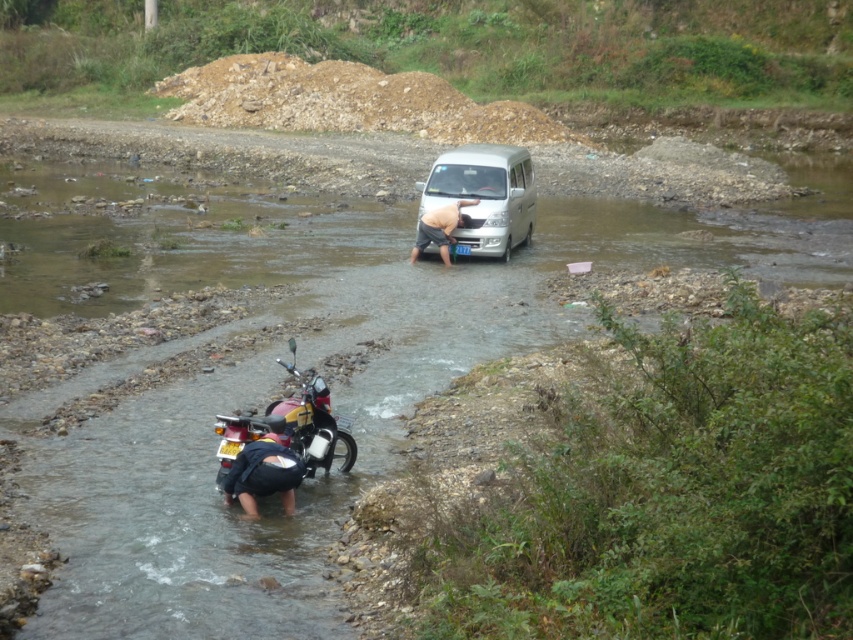
From the picture: Is white matte van at center bigger than skinny man at center?

Correct, white matte van at center is larger in size than skinny man at center.

Image resolution: width=853 pixels, height=640 pixels. Describe the element at coordinates (485, 195) in the screenshot. I see `white matte van at center` at that location.

Where is `white matte van at center`? This screenshot has width=853, height=640. white matte van at center is located at coordinates (485, 195).

Can you confirm if metallic red motorcycle at lower left is positioned below dark blue fabric pants at lower left?

Actually, metallic red motorcycle at lower left is above dark blue fabric pants at lower left.

Who is shorter, metallic red motorcycle at lower left or dark blue fabric pants at lower left?

Standing shorter between the two is dark blue fabric pants at lower left.

Which is in front, point (270, 420) or point (258, 492)?

Positioned in front is point (258, 492).

Where is `metallic red motorcycle at lower left`? metallic red motorcycle at lower left is located at coordinates (289, 428).

Can you confirm if white matte van at center is shorter than dark blue fabric pants at lower left?

No.

Between point (485, 234) and point (263, 486), which one is positioned behind?

Point (485, 234)

Is point (509, 150) farther from viewer compared to point (265, 448)?

Yes, it is.

Where is `white matte van at center`? The height and width of the screenshot is (640, 853). white matte van at center is located at coordinates (485, 195).